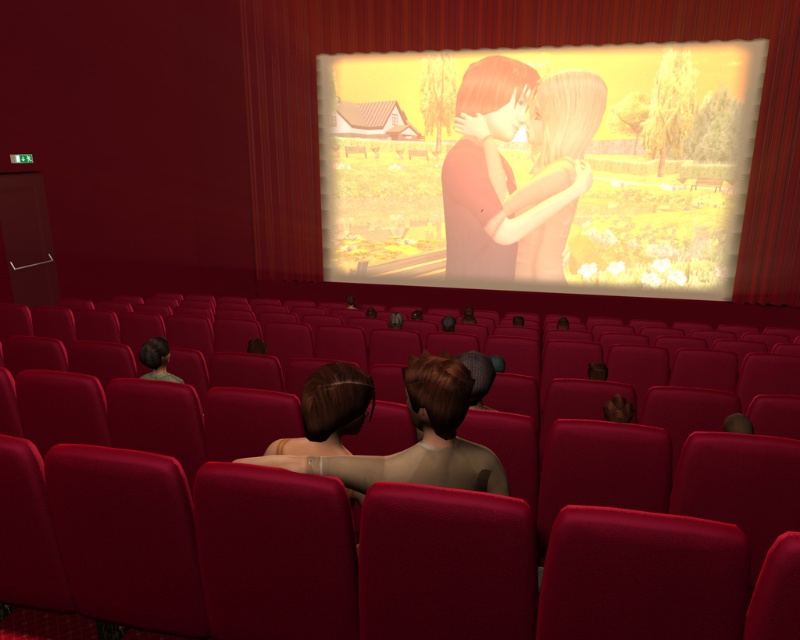
In the scene shown: Can you confirm if smooth skin couple at center is positioned above brown matte hair at center?

Indeed, smooth skin couple at center is positioned over brown matte hair at center.

The width and height of the screenshot is (800, 640). Identify the location of smooth skin couple at center. (510, 170).

I want to click on smooth skin couple at center, so click(510, 170).